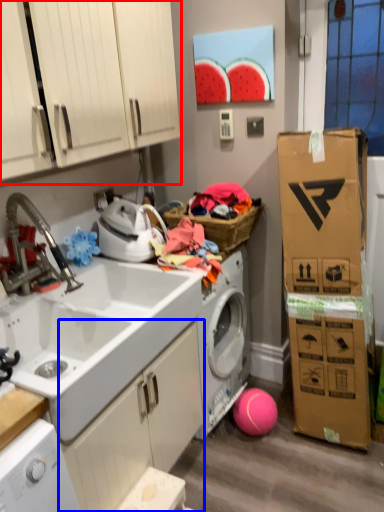
Question: Which object is further to the camera taking this photo, cabinetry (highlighted by a red box) or cabinetry (highlighted by a blue box)?

Choices:
 (A) cabinetry
 (B) cabinetry

Answer: (B)